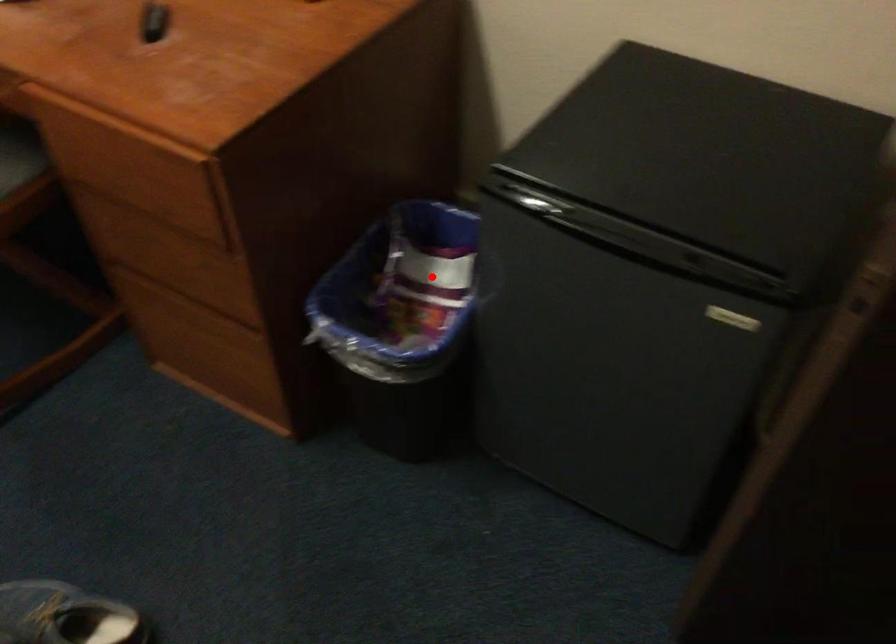
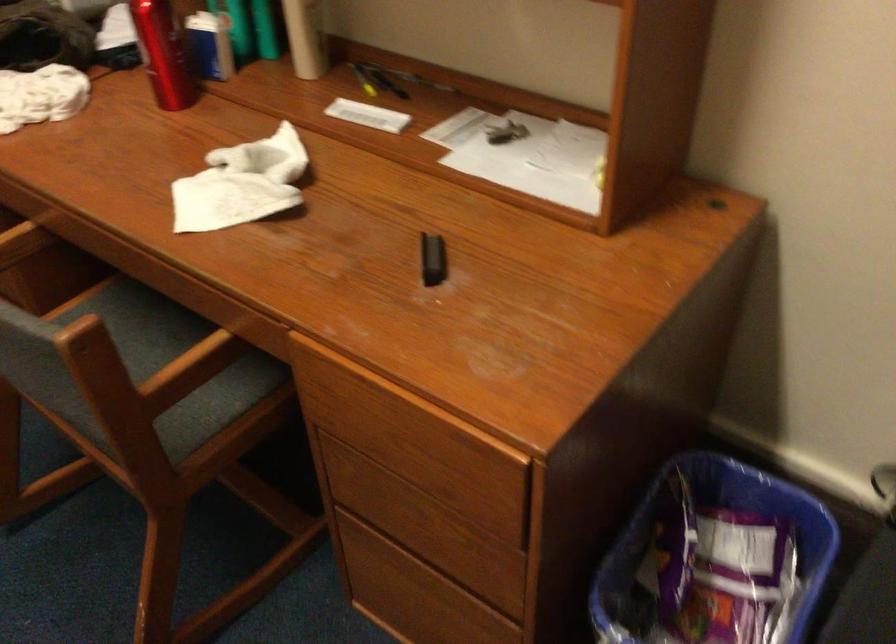
Question: I am providing you with two images of the same scene from different viewpoints. Image1 has a red point marked. In image2, the corresponding 3D location appears at what relative position? Reply with the corresponding letter.

Choices:
 (A) Closer
 (B) Farther

Answer: (A)